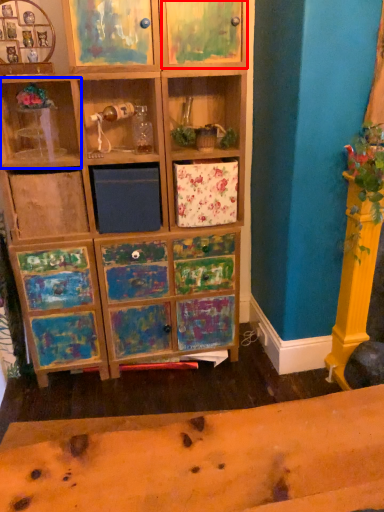
Question: Which object appears farthest to the camera in this image, cabinet (highlighted by a red box) or shelf (highlighted by a blue box)?

Choices:
 (A) cabinet
 (B) shelf

Answer: (B)